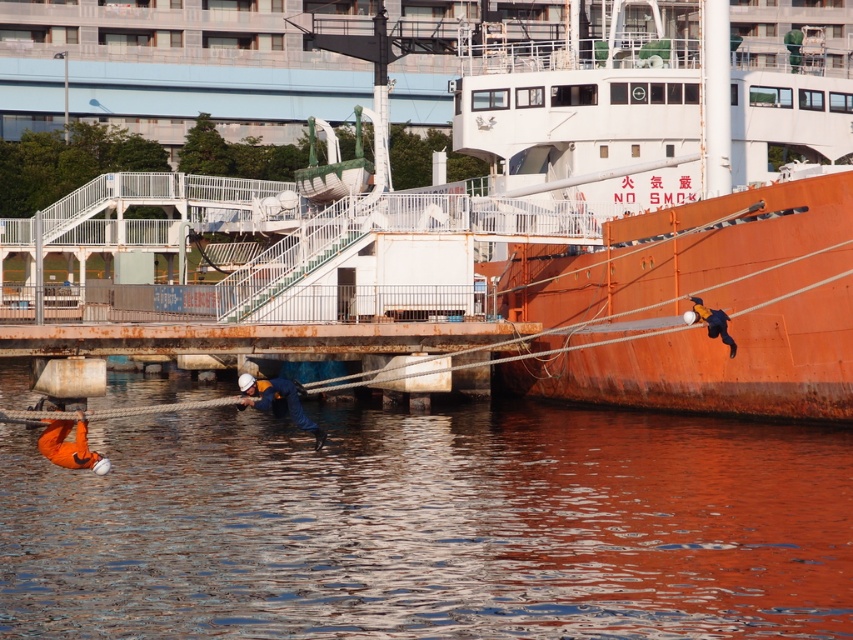
Based on the photo, who is more distant from viewer, [280,385] or [699,314]?

Result: Point [699,314]

Who is positioned more to the right, orange fabric helmet at lower center or blue fabric jacket at right?

blue fabric jacket at right is more to the right.

Find the location of a particular element. This screenshot has height=640, width=853. orange fabric helmet at lower center is located at coordinates (277, 401).

The height and width of the screenshot is (640, 853). Find the location of `orange fabric helmet at lower center`. orange fabric helmet at lower center is located at coordinates (277, 401).

Is smooth water at lower left taller than blue fabric jacket at right?

Yes.

Describe the element at coordinates (431, 525) in the screenshot. I see `smooth water at lower left` at that location.

Identify the location of smooth water at lower left. (431, 525).

You are a GUI agent. You are given a task and a screenshot of the screen. Output one action in this format:
    pyautogui.click(x=<x>, y=<y>)
    Task: Click on the smooth water at lower left
    This screenshot has width=853, height=640.
    Given the screenshot: What is the action you would take?
    pyautogui.click(x=431, y=525)

Based on the photo, which is more to the right, smooth water at lower left or orange fabric helmet at lower center?

orange fabric helmet at lower center is more to the right.

Is smooth water at lower left bigger than orange fabric helmet at lower center?

Correct, smooth water at lower left is larger in size than orange fabric helmet at lower center.

I want to click on smooth water at lower left, so click(x=431, y=525).